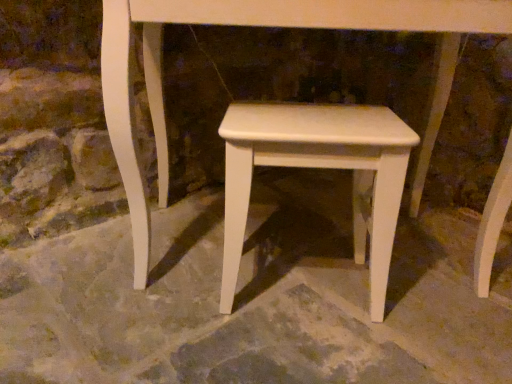
Where is `vacant area that lies to the right of white matte stool at center`? Image resolution: width=512 pixels, height=384 pixels. vacant area that lies to the right of white matte stool at center is located at coordinates (434, 301).